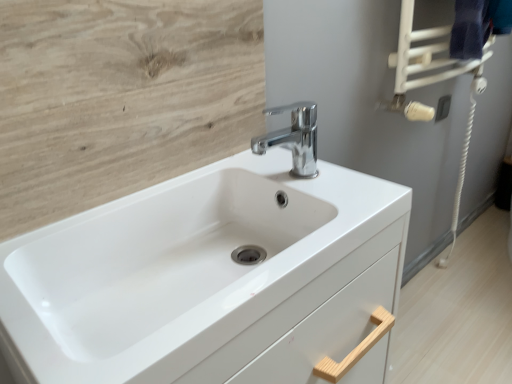
Image resolution: width=512 pixels, height=384 pixels. What are the coordinates of `free space on the front side of chrome metallic faucet at center` in the screenshot? It's located at (331, 205).